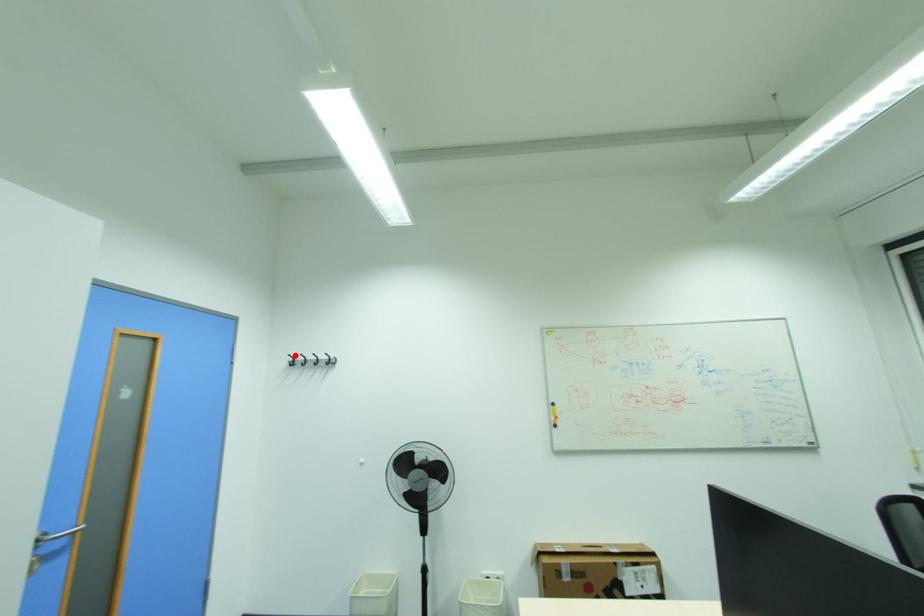
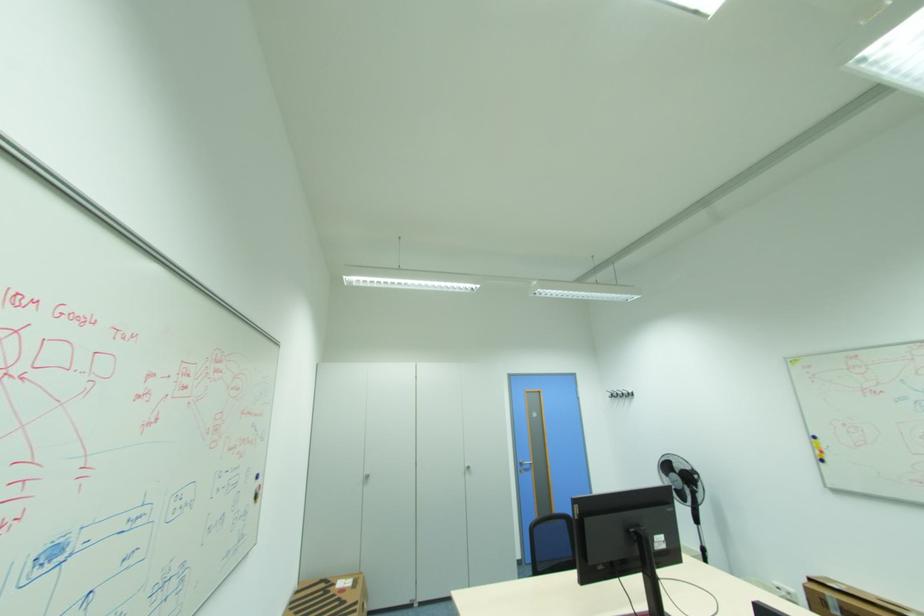
Question: I am providing you with two images of the same scene from different viewpoints. In image1, a red point is highlighted. Considering the same 3D point in image2, which of the following is correct?

Choices:
 (A) It is closer
 (B) It is farther

Answer: (B)